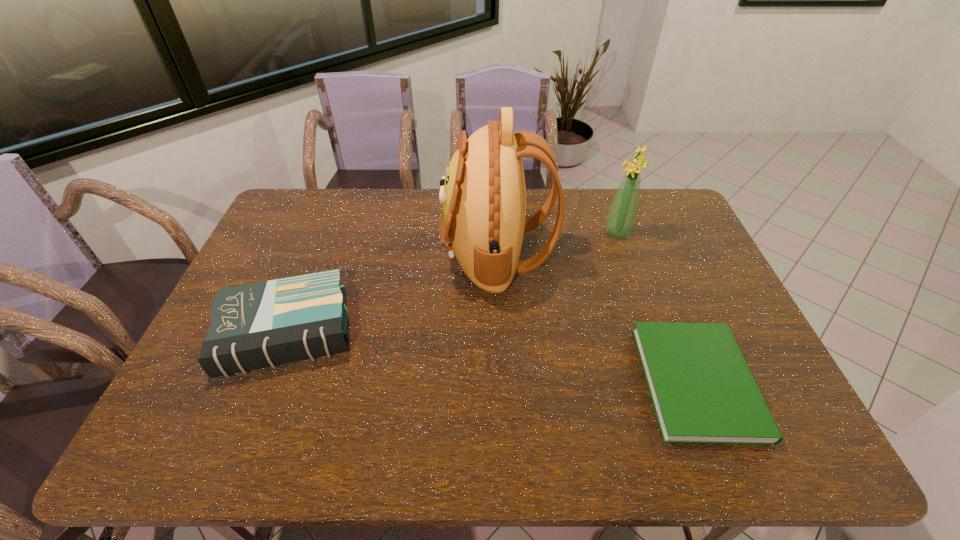
You are a GUI agent. You are given a task and a screenshot of the screen. Output one action in this format:
    pyautogui.click(x=<x>, y=<y>)
    Task: Click on the free space located 0.200m on the front-facing side of the second tallest object
    This screenshot has height=540, width=960.
    Given the screenshot: What is the action you would take?
    pyautogui.click(x=545, y=233)

Where is `blank space located on the front-facing side of the second tallest object`? The width and height of the screenshot is (960, 540). blank space located on the front-facing side of the second tallest object is located at coordinates (531, 233).

At what (x,y) coordinates should I click in order to perform the action: click on free location located 0.180m on the front-facing side of the second tallest object. Please return your answer as a coordinate pair (x, y). The height and width of the screenshot is (540, 960). Looking at the image, I should click on (551, 233).

Locate an element on the screen. The image size is (960, 540). free space located 0.290m on the back of the second shortest object is located at coordinates (327, 229).

The width and height of the screenshot is (960, 540). What are the coordinates of `free space located on the back of the shortest object` in the screenshot? It's located at (656, 276).

The height and width of the screenshot is (540, 960). Find the location of `backpack that is at the far edge`. backpack that is at the far edge is located at coordinates (483, 196).

The height and width of the screenshot is (540, 960). I want to click on bouquet located at the far edge, so click(x=621, y=217).

The height and width of the screenshot is (540, 960). What are the coordinates of `object that is at the near edge` in the screenshot? It's located at (703, 392).

Where is `object at the left edge`? object at the left edge is located at coordinates (265, 324).

The width and height of the screenshot is (960, 540). I want to click on object that is at the right edge, so click(x=703, y=392).